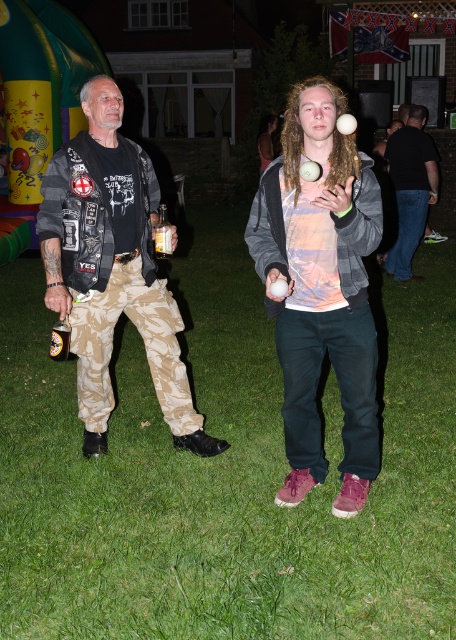
Can you confirm if green grass at center is shorter than black cotton shirt at right?

Correct, green grass at center is not as tall as black cotton shirt at right.

Is green grass at center below black cotton shirt at right?

Yes, green grass at center is below black cotton shirt at right.

Image resolution: width=456 pixels, height=640 pixels. Describe the element at coordinates (223, 476) in the screenshot. I see `green grass at center` at that location.

The height and width of the screenshot is (640, 456). Identify the location of green grass at center. (223, 476).

Is point (399, 193) less distant than point (61, 342)?

No, it is behind (61, 342).

Is black cotton shirt at right thinner than metallic gold can at lower left?

No, black cotton shirt at right is not thinner than metallic gold can at lower left.

Is point (424, 134) positioned before point (62, 326)?

That is False.

Identify the location of black cotton shirt at right. The height and width of the screenshot is (640, 456). (410, 188).

Between green grass at center and metallic gold can at lower left, which one is positioned lower?

green grass at center is lower down.

Does green grass at center have a greater width compared to metallic gold can at lower left?

Correct, the width of green grass at center exceeds that of metallic gold can at lower left.

I want to click on green grass at center, so click(223, 476).